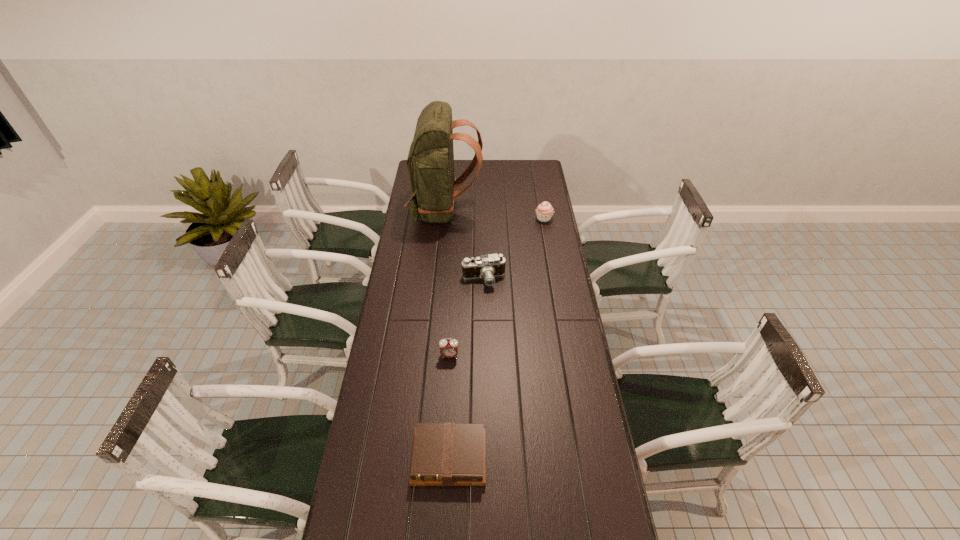
Where is `blank space located 0.090m on the spine side of the shortest object`? This screenshot has height=540, width=960. blank space located 0.090m on the spine side of the shortest object is located at coordinates (446, 520).

The image size is (960, 540). Find the location of `object located at the left edge`. object located at the left edge is located at coordinates (430, 162).

Locate an element on the screen. This screenshot has width=960, height=540. object that is at the right edge is located at coordinates (544, 211).

The image size is (960, 540). Identify the location of vacant space at the far edge of the desktop. (515, 177).

The height and width of the screenshot is (540, 960). Find the location of `vacant area at the left edge of the desktop`. vacant area at the left edge of the desktop is located at coordinates (384, 470).

In order to click on free space at the right edge of the desktop in this screenshot , I will do `click(566, 361)`.

The height and width of the screenshot is (540, 960). In the image, there is a desktop. In order to click on vacant space at the far right corner in this screenshot , I will do `click(537, 163)`.

This screenshot has width=960, height=540. I want to click on vacant space in between the alarm clock and the cupcake, so click(x=496, y=287).

Locate an element on the screen. vacant area between the cupcake and the alarm clock is located at coordinates (496, 287).

This screenshot has width=960, height=540. I want to click on unoccupied area between the alarm clock and the rightmost object, so click(x=496, y=287).